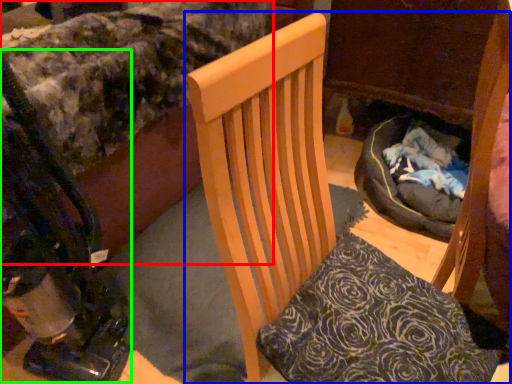
Question: Which object is positioned farthest from bed (highlighted by a red box)? Select from chair (highlighted by a blue box) and baby carriage (highlighted by a green box).

Choices:
 (A) chair
 (B) baby carriage

Answer: (A)